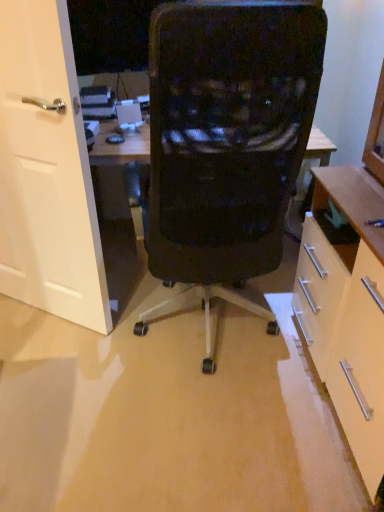
In order to click on vacant area situated below black mesh chair at center (from a real-world perspective) in this screenshot , I will do `click(204, 339)`.